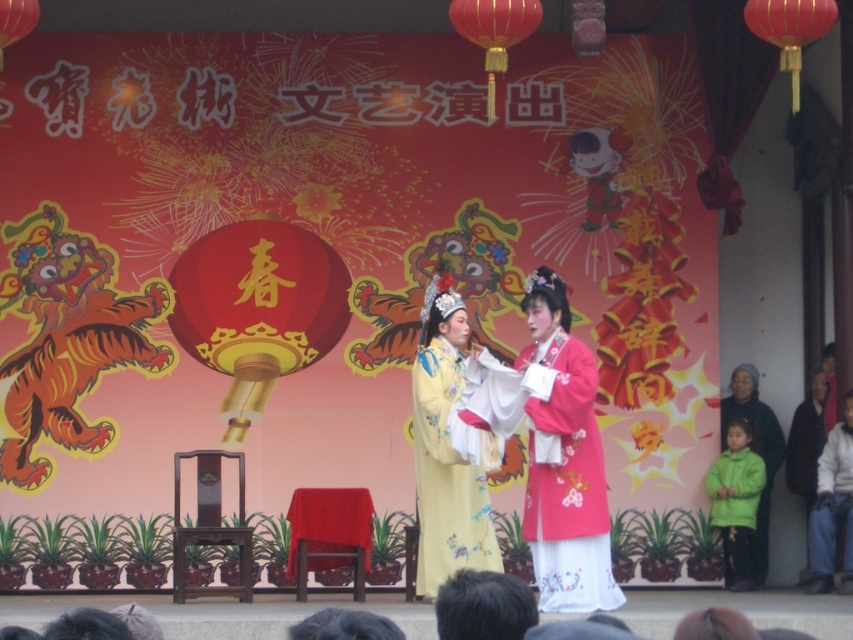
Is green fuzzy coat at lower right behind dark brown leather jacket at right?

Yes, green fuzzy coat at lower right is further from the viewer.

Which of these two, green fuzzy coat at lower right or dark brown leather jacket at right, stands taller?

dark brown leather jacket at right

Measure the distance between green fuzzy coat at lower right and camera.

58.13 meters

I want to click on green fuzzy coat at lower right, so click(x=763, y=461).

Who is taller, matte pink fabric dress at center or green fuzzy coat at lower right?

matte pink fabric dress at center

This screenshot has width=853, height=640. What do you see at coordinates (567, 481) in the screenshot? I see `matte pink fabric dress at center` at bounding box center [567, 481].

Identify the location of matte pink fabric dress at center. This screenshot has width=853, height=640. (567, 481).

Does matte pink fabric dress at center appear over dark brown leather jacket at right?

No.

Does matte pink fabric dress at center have a greater width compared to dark brown leather jacket at right?

No.

Does point (583, 474) come behind point (799, 424)?

That is False.

Where is `matte pink fabric dress at center`? matte pink fabric dress at center is located at coordinates (567, 481).